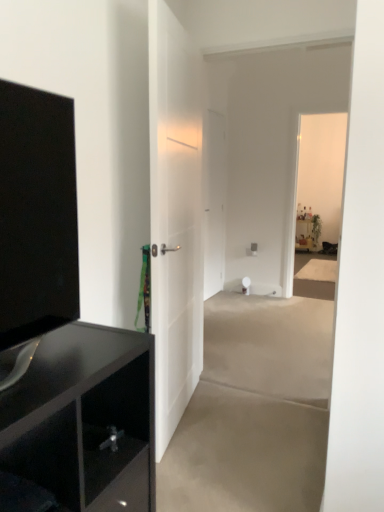
Question: Is white matte door at center, which is the 1th door in left-to-right order, wider than glossy black cabinet at left?

Choices:
 (A) no
 (B) yes

Answer: (A)

Question: Is white matte door at center, which is the 1th door in left-to-right order, positioned beyond the bounds of glossy black cabinet at left?

Choices:
 (A) yes
 (B) no

Answer: (A)

Question: From the image's perspective, does white matte door at center, which is the 1th door in left-to-right order, appear higher than glossy black cabinet at left?

Choices:
 (A) yes
 (B) no

Answer: (A)

Question: From the image's perspective, is white matte door at center, which is the 1th door in left-to-right order, beneath glossy black cabinet at left?

Choices:
 (A) no
 (B) yes

Answer: (A)

Question: Does white matte door at center, which is the first door in front-to-back order, have a lesser width compared to glossy black cabinet at left?

Choices:
 (A) yes
 (B) no

Answer: (A)

Question: Is white matte door at center, acting as the second door starting from the right, bigger than glossy black cabinet at left?

Choices:
 (A) yes
 (B) no

Answer: (B)

Question: Considering the relative sizes of gray matte concrete at center, marked as the 1th concrete in a bottom-to-top arrangement, and white matte toilet paper at center in the image provided, is gray matte concrete at center, marked as the 1th concrete in a bottom-to-top arrangement, smaller than white matte toilet paper at center?

Choices:
 (A) no
 (B) yes

Answer: (A)

Question: From a real-world perspective, is gray matte concrete at center, marked as the 1th concrete in a bottom-to-top arrangement, located beneath white matte toilet paper at center?

Choices:
 (A) yes
 (B) no

Answer: (A)

Question: Is gray matte concrete at center, which ranks as the 2th concrete in top-to-bottom order, aimed at white matte toilet paper at center?

Choices:
 (A) yes
 (B) no

Answer: (B)

Question: Could white matte toilet paper at center be considered to be inside gray matte concrete at center, which ranks as the 2th concrete in top-to-bottom order?

Choices:
 (A) no
 (B) yes

Answer: (A)

Question: Is gray matte concrete at center, which ranks as the 2th concrete in top-to-bottom order, located outside white matte toilet paper at center?

Choices:
 (A) no
 (B) yes

Answer: (B)

Question: Does gray matte concrete at center, which ranks as the 2th concrete in top-to-bottom order, have a greater height compared to white matte toilet paper at center?

Choices:
 (A) yes
 (B) no

Answer: (B)

Question: Is white matte door at center, which is the 1th door in left-to-right order, at the right side of gray matte concrete at center, which ranks as the 2th concrete in top-to-bottom order?

Choices:
 (A) no
 (B) yes

Answer: (A)